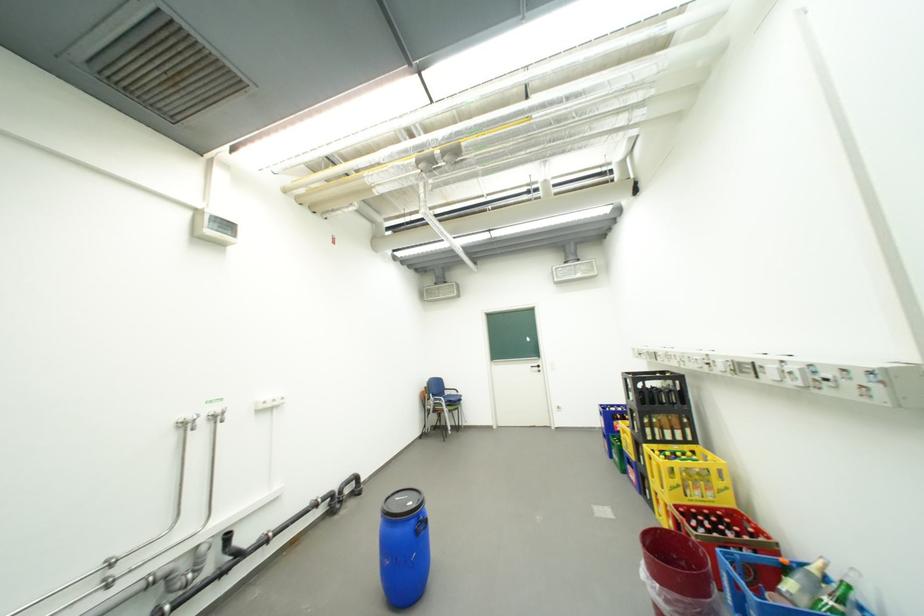
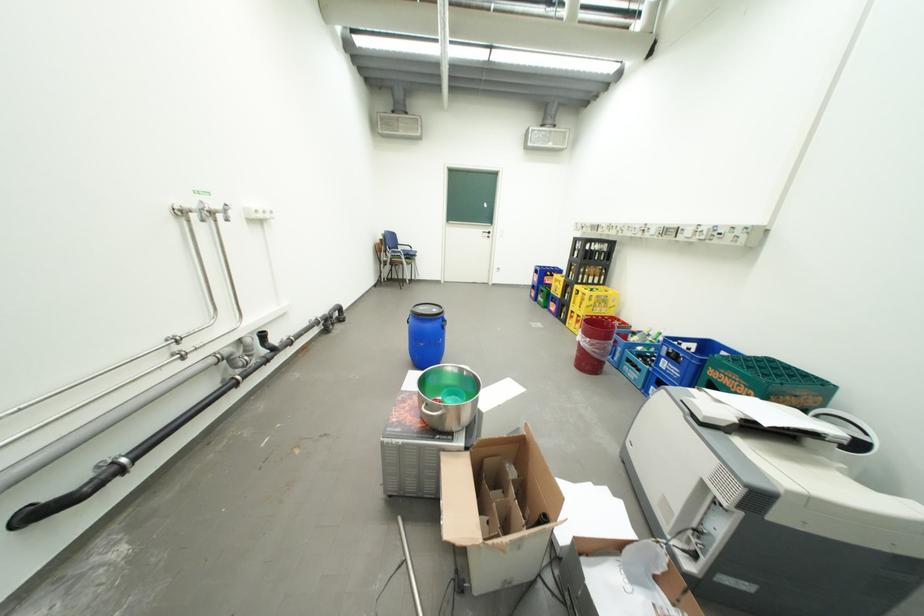
The point at (674,495) is marked in the first image. Where is the corresponding point in the second image?

(590, 312)